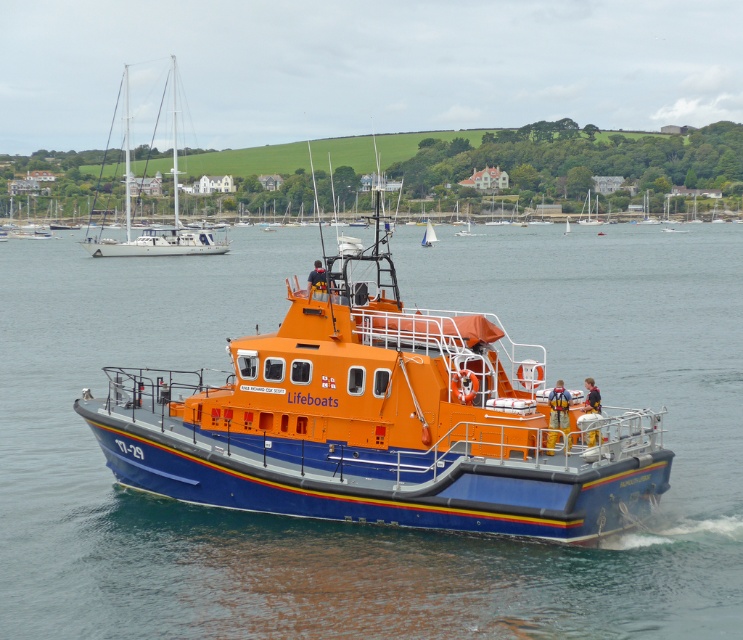
Consider the image. Is orange matte lifeboat at center below orange fiberglass sailboat at center?

Yes, orange matte lifeboat at center is below orange fiberglass sailboat at center.

Can you confirm if orange matte lifeboat at center is smaller than orange fiberglass sailboat at center?

No, orange matte lifeboat at center is not smaller than orange fiberglass sailboat at center.

Is point (429, 240) in front of point (585, 221)?

That is True.

The height and width of the screenshot is (640, 743). I want to click on orange matte lifeboat at center, so click(428, 236).

Can you confirm if blue water at center is bigger than orange matte lifeboat at center?

Yes.

Can you confirm if blue water at center is shorter than orange matte lifeboat at center?

In fact, blue water at center may be taller than orange matte lifeboat at center.

Image resolution: width=743 pixels, height=640 pixels. Identify the location of blue water at center. (354, 522).

Which is below, orange matte sailboat at upper left or orange fiberglass sailboat at center?

Positioned lower is orange fiberglass sailboat at center.

Is point (107, 256) more distant than point (597, 221)?

No, (107, 256) is in front of (597, 221).

At what (x,y) coordinates should I click in order to perform the action: click on orange matte sailboat at upper left. Please return your answer as a coordinate pair (x, y). The image size is (743, 640). Looking at the image, I should click on (155, 227).